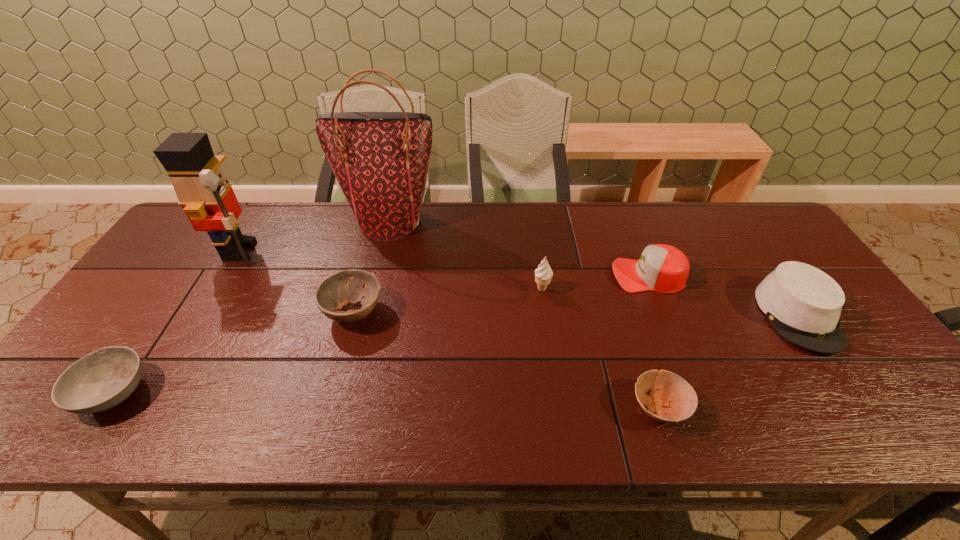
Locate an element on the screen. This screenshot has height=540, width=960. vacant region at the far left corner of the desktop is located at coordinates (194, 243).

The image size is (960, 540). I want to click on vacant area that lies between the rightmost bowl and the seventh shortest object, so click(449, 329).

Locate an element on the screen. This screenshot has height=540, width=960. free spot between the rightmost bowl and the second tallest object is located at coordinates (449, 329).

The width and height of the screenshot is (960, 540). I want to click on vacant space in between the sixth shortest object and the handbag, so click(467, 255).

The width and height of the screenshot is (960, 540). What are the coordinates of `free area in between the rightmost object and the handbag` in the screenshot? It's located at point(594,268).

Where is `empty location between the hat and the leftmost bowl`? empty location between the hat and the leftmost bowl is located at coordinates (455, 354).

This screenshot has width=960, height=540. I want to click on unoccupied area between the handbag and the rightmost bowl, so click(x=525, y=314).

Where is `free space between the hat and the second tallest object`? Image resolution: width=960 pixels, height=540 pixels. free space between the hat and the second tallest object is located at coordinates (519, 283).

The width and height of the screenshot is (960, 540). I want to click on vacant point located between the tallest object and the icecream, so click(x=467, y=255).

Find the location of a particular element. vacant space that is in between the rightmost bowl and the fourth object from right to left is located at coordinates (601, 348).